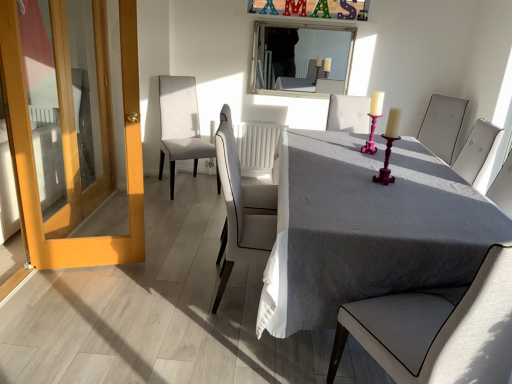
Question: Does light beige fabric chair at center, which is counted as the 1th chair, starting from the left, have a lesser height compared to white leather chair at center, which is counted as the fourth chair, starting from the back?

Choices:
 (A) no
 (B) yes

Answer: (B)

Question: Does light beige fabric chair at center, acting as the first chair starting from the back, have a larger size compared to white leather chair at center, the fourth chair viewed from the right?

Choices:
 (A) no
 (B) yes

Answer: (B)

Question: Does light beige fabric chair at center, acting as the first chair starting from the back, have a smaller size compared to white leather chair at center, the fourth chair viewed from the right?

Choices:
 (A) no
 (B) yes

Answer: (A)

Question: From a real-world perspective, is light beige fabric chair at center, acting as the first chair starting from the back, under white leather chair at center, which appears as the second chair when viewed from the left?

Choices:
 (A) yes
 (B) no

Answer: (A)

Question: Could you tell me if light beige fabric chair at center, which ranks as the 5th chair in front-to-back order, is turned towards white leather chair at center, the second chair in the front-to-back sequence?

Choices:
 (A) no
 (B) yes

Answer: (B)

Question: Looking at their shapes, would you say gray fabric table at center is wider or thinner than wooden door at left?

Choices:
 (A) thin
 (B) wide

Answer: (B)

Question: In terms of size, does gray fabric table at center appear bigger or smaller than wooden door at left?

Choices:
 (A) small
 (B) big

Answer: (B)

Question: Relative to wooden door at left, is gray fabric table at center in front or behind?

Choices:
 (A) front
 (B) behind

Answer: (A)

Question: Is gray fabric table at center situated inside wooden door at left or outside?

Choices:
 (A) inside
 (B) outside

Answer: (B)

Question: Is point (364, 105) closer or farther from the camera than point (478, 349)?

Choices:
 (A) closer
 (B) farther

Answer: (B)

Question: Looking at their shapes, would you say matte white chair at center, the second chair positioned from the right, is wider or thinner than light gray fabric chair at center, the 5th chair positioned from the back?

Choices:
 (A) wide
 (B) thin

Answer: (B)

Question: From a real-world perspective, is matte white chair at center, which is the 4th chair from left to right, physically located above or below light gray fabric chair at center, which is counted as the 3th chair, starting from the left?

Choices:
 (A) below
 (B) above

Answer: (B)

Question: Is matte white chair at center, the second chair positioned from the right, taller or shorter than light gray fabric chair at center, marked as the third chair in a right-to-left arrangement?

Choices:
 (A) tall
 (B) short

Answer: (B)

Question: Based on their sizes in the image, would you say matte white chair at center, the third chair in the front-to-back sequence, is bigger or smaller than light beige fabric chair at center, marked as the fifth chair in a right-to-left arrangement?

Choices:
 (A) big
 (B) small

Answer: (B)

Question: Looking at their shapes, would you say matte white chair at center, which is the 4th chair from left to right, is wider or thinner than light beige fabric chair at center, which ranks as the 5th chair in front-to-back order?

Choices:
 (A) thin
 (B) wide

Answer: (A)